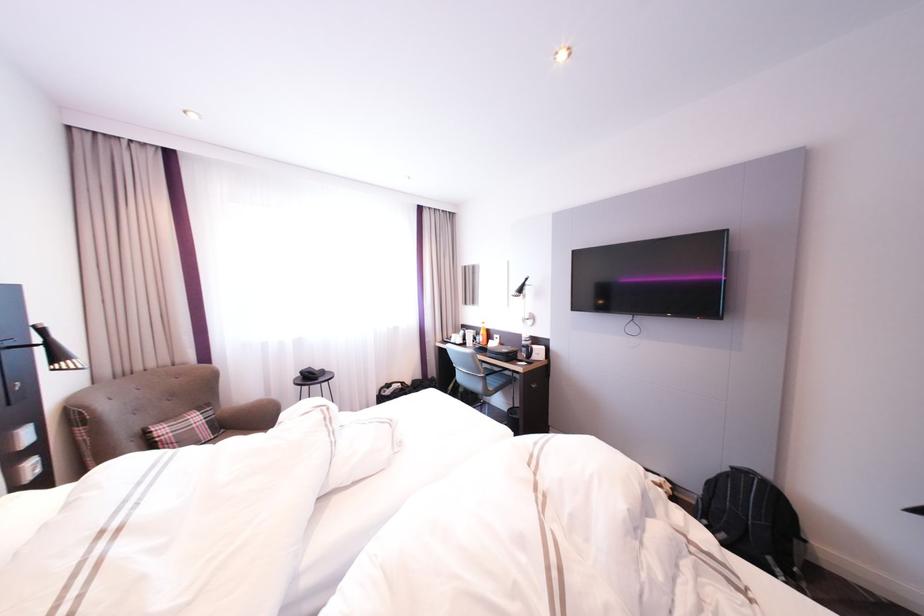
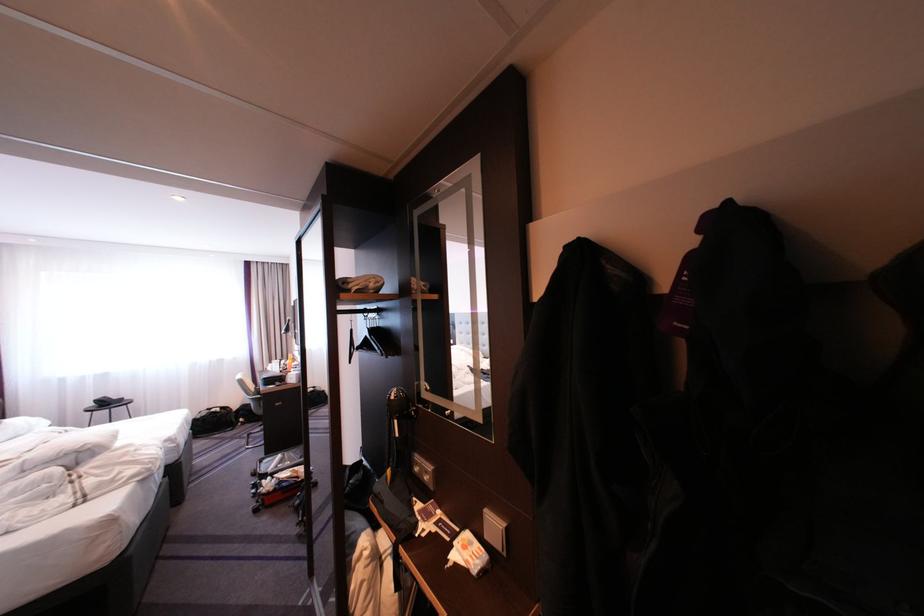
Where in the second image is the point corresponding to pixel 492 373 from the first image?

(261, 395)